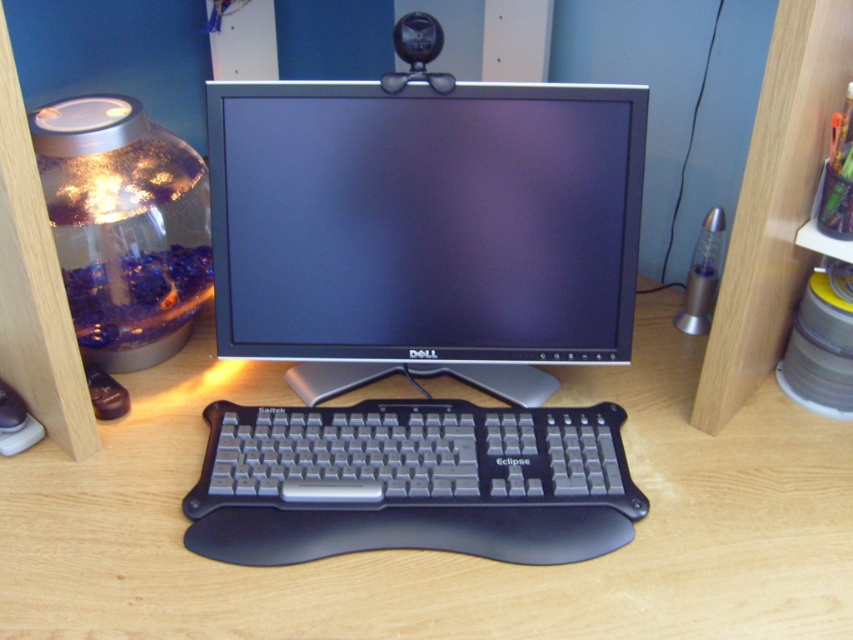
You are setting up a new mouse pad for your workstation. The mouse pad is 30 cm wide and needs to be placed to the right of the black plastic keyboard at center. Given the desk space available, can you confirm if there is enough room to place the mouse pad without overlapping any other objects?

The black plastic keyboard at center is positioned at point (437, 552). Since the mouse pad is 30 cm wide and needs to be placed to the right of the keyboard, there should be sufficient desk space available to accommodate it without overlapping other objects, assuming standard desk dimensions.

You are setting up a new webcam on the desk. The webcam requires a minimum distance of 7 inches between the monitor and keyboard to avoid interference. Based on the image, will the current setup between the satin black monitor at center and the satin black keyboard at center meet this requirement?

The satin black monitor at center is 6.88 inches from the satin black keyboard at center. Since 6.88 inches is less than the required 7 inches, the current setup does not meet the webcam requirement.

From the picture: You are standing at a distance of 36 inches from the computer workstation. Can you reach the point labeled as point (467,218) without moving closer?

The point labeled as point (467,218) is 34.69 inches from the viewer. Since you are standing 36 inches away, you are slightly farther than the point, so you can reach it without moving closer.